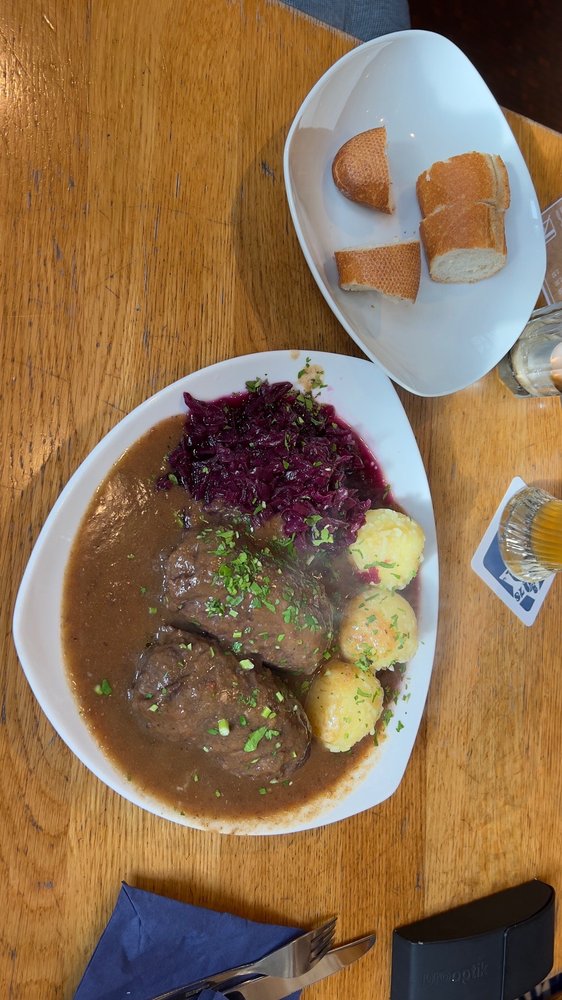
At what (x,y) coordinates should I click in order to perform the action: click on black napkin. Please return your answer as a coordinate pair (x, y). Looking at the image, I should click on [155, 920].